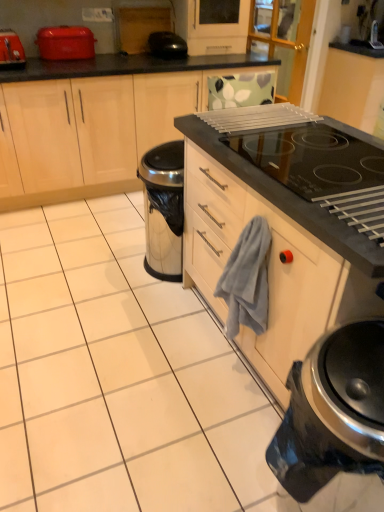
Consider the image. What is the approximate width of matte red toaster at upper left, which is the 1th kitchen appliance in top-to-bottom order?

The width of matte red toaster at upper left, which is the 1th kitchen appliance in top-to-bottom order, is 9.59 inches.

Where is `matte red toaster at upper left, the second kitchen appliance positioned from the right`? matte red toaster at upper left, the second kitchen appliance positioned from the right is located at coordinates (65, 42).

What do you see at coordinates (288, 200) in the screenshot?
I see `black glass oven at upper right` at bounding box center [288, 200].

Describe the element at coordinates (11, 50) in the screenshot. I see `matte red toaster at upper left, the 1th kitchen appliance in the left-to-right sequence` at that location.

From the picture: In order to face gray cotton hand towel at center, should I rotate leftwards or rightwards?

You should look right and rotate roughly 6.725 degrees.

What do you see at coordinates (97, 127) in the screenshot? I see `matte wood cabinets at left` at bounding box center [97, 127].

This screenshot has height=512, width=384. I want to click on satin black kettle at lower right, the third kitchen appliance positioned from the left, so click(x=333, y=411).

Locate an element on the screen. The width and height of the screenshot is (384, 512). matte red toaster at upper left, which is the 1th kitchen appliance in top-to-bottom order is located at coordinates (65, 42).

What's the angular difference between black glossy toaster at upper center and black glass oven at upper right's facing directions?

The angular difference between black glossy toaster at upper center and black glass oven at upper right is 7.88 degrees.

Measure the distance from black glossy toaster at upper center to black glass oven at upper right.

black glossy toaster at upper center and black glass oven at upper right are 5.36 feet apart.

Does black glossy toaster at upper center have a lesser height compared to black glass oven at upper right?

Yes.

Which is further, (163, 42) or (220, 139)?

The point (163, 42) is farther from the camera.

Can you tell me how much satin black kettle at lower right, which appears as the 1th kitchen appliance when viewed from the front, and matte wood cabinets at left differ in facing direction?

89.4 degrees.

From a real-world perspective, is satin black kettle at lower right, the third kitchen appliance when ordered from top to bottom, physically above matte wood cabinets at left?

No, from a real-world perspective, satin black kettle at lower right, the third kitchen appliance when ordered from top to bottom, is not over matte wood cabinets at left

Is satin black kettle at lower right, the third kitchen appliance positioned from the left, facing towards matte wood cabinets at left?

No.

Considering the relative sizes of satin black kettle at lower right, the third kitchen appliance when ordered from top to bottom, and matte wood cabinets at left in the image provided, is satin black kettle at lower right, the third kitchen appliance when ordered from top to bottom, wider than matte wood cabinets at left?

Incorrect, the width of satin black kettle at lower right, the third kitchen appliance when ordered from top to bottom, does not surpass that of matte wood cabinets at left.

Which is in front, point (81, 131) or point (8, 48)?

The point (8, 48) is closer.

How different are the orientations of matte wood cabinets at left and matte red toaster at upper left, the 3th kitchen appliance when ordered from right to left, in degrees?

The angular difference between matte wood cabinets at left and matte red toaster at upper left, the 3th kitchen appliance when ordered from right to left, is 0.316 degrees.

Locate an element on the screen. the 2nd kitchen appliance counting from the left side of the matte wood cabinets at left is located at coordinates (11, 50).

Based on the photo, considering the relative positions of matte wood cabinets at left and matte red toaster at upper left, positioned as the 2th kitchen appliance in top-to-bottom order, in the image provided, is matte wood cabinets at left to the right of matte red toaster at upper left, positioned as the 2th kitchen appliance in top-to-bottom order, from the viewer's perspective?

Indeed, matte wood cabinets at left is positioned on the right side of matte red toaster at upper left, positioned as the 2th kitchen appliance in top-to-bottom order.

Does matte red toaster at upper left, which is the 1th kitchen appliance in top-to-bottom order, turn towards gray cotton hand towel at center?

Yes.

Is point (50, 31) behind point (255, 262)?

Yes, point (50, 31) is farther from viewer.

From a real-world perspective, which is physically below, matte red toaster at upper left, marked as the 3th kitchen appliance in a bottom-to-top arrangement, or gray cotton hand towel at center?

In real-world perspective, gray cotton hand towel at center is lower.

Is black glossy toaster at upper center to the right of matte red toaster at upper left, the second kitchen appliance positioned from the right, from the viewer's perspective?

Yes.

Considering the relative sizes of black glossy toaster at upper center and matte red toaster at upper left, marked as the 3th kitchen appliance in a bottom-to-top arrangement, in the image provided, is black glossy toaster at upper center smaller than matte red toaster at upper left, marked as the 3th kitchen appliance in a bottom-to-top arrangement,?

Correct, black glossy toaster at upper center occupies less space than matte red toaster at upper left, marked as the 3th kitchen appliance in a bottom-to-top arrangement.

Find the location of a particular element. appliance above the matte red toaster at upper left, marked as the 3th kitchen appliance in a bottom-to-top arrangement (from the image's perspective) is located at coordinates (167, 45).

Which is nearer, (261, 268) or (38, 34)?

The point (261, 268) is closer to the camera.

From the image's perspective, is gray cotton hand towel at center above or below matte red toaster at upper left, which is the 3th kitchen appliance from front to back?

From the image's perspective, gray cotton hand towel at center appears below matte red toaster at upper left, which is the 3th kitchen appliance from front to back.

Which of these two, gray cotton hand towel at center or matte red toaster at upper left, which is the 3th kitchen appliance from front to back, stands taller?

gray cotton hand towel at center is taller.

Considering the sizes of gray cotton hand towel at center and matte red toaster at upper left, marked as the 3th kitchen appliance in a bottom-to-top arrangement, in the image, is gray cotton hand towel at center bigger or smaller than matte red toaster at upper left, marked as the 3th kitchen appliance in a bottom-to-top arrangement,?

Clearly, gray cotton hand towel at center is smaller in size than matte red toaster at upper left, marked as the 3th kitchen appliance in a bottom-to-top arrangement.

Is matte wood cabinets at left further to camera compared to gray cotton hand towel at center?

Yes, matte wood cabinets at left is further from the camera.

Does matte wood cabinets at left have a smaller size compared to gray cotton hand towel at center?

No.

Can gray cotton hand towel at center be found inside matte wood cabinets at left?

Definitely not — gray cotton hand towel at center is not inside matte wood cabinets at left.

The height and width of the screenshot is (512, 384). In order to click on appliance located behind the black glass oven at upper right in this screenshot , I will do `click(167, 45)`.

I want to click on kitchen appliance below the matte wood cabinets at left (from the image's perspective), so click(x=333, y=411).

Based on their spatial positions, is satin black kettle at lower right, arranged as the 1th kitchen appliance when ordered from the bottom, or gray cotton hand towel at center closer to matte red toaster at upper left, the 3th kitchen appliance when ordered from right to left?

Among the two, gray cotton hand towel at center is located nearer to matte red toaster at upper left, the 3th kitchen appliance when ordered from right to left.

Based on their spatial positions, is matte red toaster at upper left, positioned as the 2th kitchen appliance in top-to-bottom order, or matte red toaster at upper left, the second kitchen appliance positioned from the right, further from black glass oven at upper right?

matte red toaster at upper left, positioned as the 2th kitchen appliance in top-to-bottom order, is positioned further to the anchor black glass oven at upper right.

Estimate the real-world distances between objects in this image. Which object is closer to black glass oven at upper right, matte wood cabinets at left or matte red toaster at upper left, marked as the 3th kitchen appliance in a bottom-to-top arrangement?

matte wood cabinets at left lies closer to black glass oven at upper right than the other object.

Based on their spatial positions, is matte red toaster at upper left, the 3th kitchen appliance when ordered from right to left, or gray cotton hand towel at center further from black glossy toaster at upper center?

gray cotton hand towel at center is further to black glossy toaster at upper center.

Considering their positions, is matte red toaster at upper left, the second kitchen appliance in the bottom-to-top sequence, positioned closer to matte wood cabinets at left than gray cotton hand towel at center?

Among the two, matte red toaster at upper left, the second kitchen appliance in the bottom-to-top sequence, is located nearer to matte wood cabinets at left.

From the image, which object appears to be nearer to black glass oven at upper right, black glossy toaster at upper center or matte wood cabinets at left?

Based on the image, matte wood cabinets at left appears to be nearer to black glass oven at upper right.

Consider the image. From the image, which object appears to be farther from satin black kettle at lower right, which appears as the 1th kitchen appliance when viewed from the front, gray cotton hand towel at center or matte red toaster at upper left, the second kitchen appliance positioned from the right?

Based on the image, matte red toaster at upper left, the second kitchen appliance positioned from the right, appears to be further to satin black kettle at lower right, which appears as the 1th kitchen appliance when viewed from the front.

Which object lies nearer to the anchor point satin black kettle at lower right, the 3th kitchen appliance from the back, matte red toaster at upper left, the 3th kitchen appliance when ordered from right to left, or black glass oven at upper right?

black glass oven at upper right is closer to satin black kettle at lower right, the 3th kitchen appliance from the back.

This screenshot has height=512, width=384. Identify the location of oven between matte red toaster at upper left, the second kitchen appliance from the front, and satin black kettle at lower right, arranged as the 1th kitchen appliance when viewed from the right, vertically. (288, 200).

The width and height of the screenshot is (384, 512). Find the location of `oven that lies between matte red toaster at upper left, acting as the 2th kitchen appliance starting from the left, and satin black kettle at lower right, the third kitchen appliance positioned from the left, from top to bottom`. oven that lies between matte red toaster at upper left, acting as the 2th kitchen appliance starting from the left, and satin black kettle at lower right, the third kitchen appliance positioned from the left, from top to bottom is located at coordinates (288, 200).

At what (x,y) coordinates should I click in order to perform the action: click on hand towel between matte red toaster at upper left, which is the 1th kitchen appliance in top-to-bottom order, and satin black kettle at lower right, the third kitchen appliance when ordered from top to bottom, in the up-down direction. Please return your answer as a coordinate pair (x, y). The image size is (384, 512). Looking at the image, I should click on (247, 279).

Find the location of `cabinetry that lies between matte red toaster at upper left, the second kitchen appliance from the back, and gray cotton hand towel at center from top to bottom`. cabinetry that lies between matte red toaster at upper left, the second kitchen appliance from the back, and gray cotton hand towel at center from top to bottom is located at coordinates (97, 127).